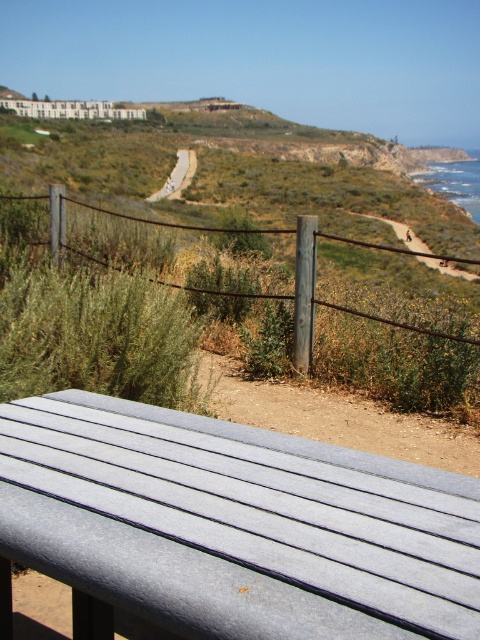
Which of these two, gray wood picnic table at lower center or metal wire fence at lower center, stands taller?

metal wire fence at lower center

Which is below, gray wood picnic table at lower center or metal wire fence at lower center?

Positioned lower is gray wood picnic table at lower center.

This screenshot has width=480, height=640. What are the coordinates of `gray wood picnic table at lower center` in the screenshot? It's located at (236, 524).

How distant is metal wire fence at lower center from dirt/path at center?

metal wire fence at lower center and dirt/path at center are 87.07 feet apart from each other.

Between metal wire fence at lower center and dirt/path at center, which one is positioned higher?

Positioned higher is dirt/path at center.

Is point (104, 228) farther from viewer compared to point (186, 164)?

That is False.

Where is `metal wire fence at lower center`? metal wire fence at lower center is located at coordinates (157, 278).

Does point (359, 467) come farther from viewer compared to point (192, 170)?

No, (359, 467) is in front of (192, 170).

Which is behind, point (389, 605) or point (182, 179)?

The point (182, 179) is behind.

Which is in front, point (432, 531) or point (153, 195)?

Positioned in front is point (432, 531).

Locate an element on the screen. gray wood picnic table at lower center is located at coordinates (236, 524).